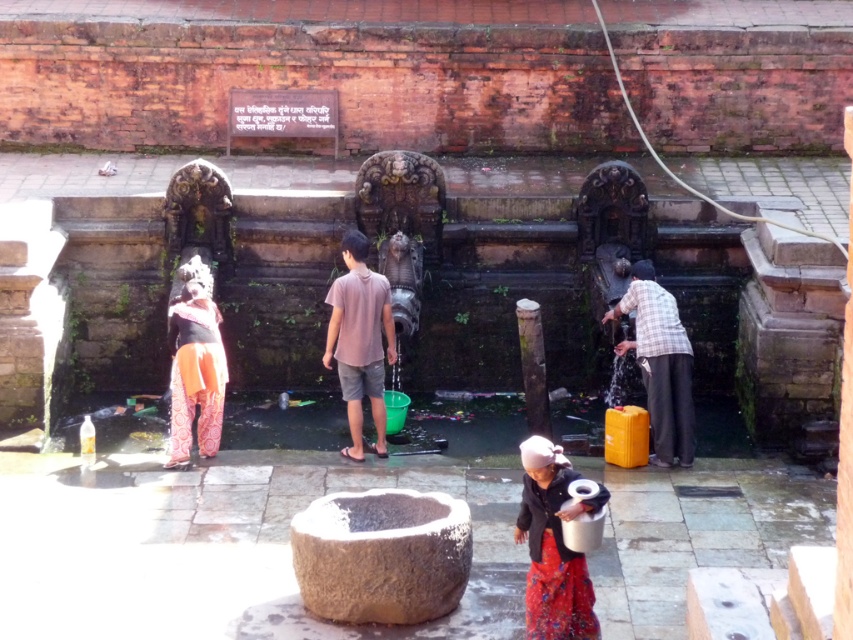
Is red fabric skirt at lower center wider than orange printed pants at center?

Incorrect, red fabric skirt at lower center's width does not surpass orange printed pants at center's.

Does red fabric skirt at lower center appear on the left side of orange printed pants at center?

No, red fabric skirt at lower center is not to the left of orange printed pants at center.

Which is in front, point (538, 484) or point (186, 426)?

Point (538, 484) is in front.

This screenshot has height=640, width=853. I want to click on red fabric skirt at lower center, so [x=553, y=547].